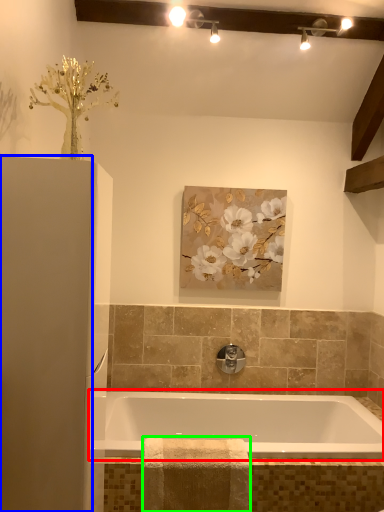
Question: Which object is the farthest from bathtub (highlighted by a red box)? Choose among these: screen door (highlighted by a blue box) or material (highlighted by a green box).

Choices:
 (A) screen door
 (B) material

Answer: (A)